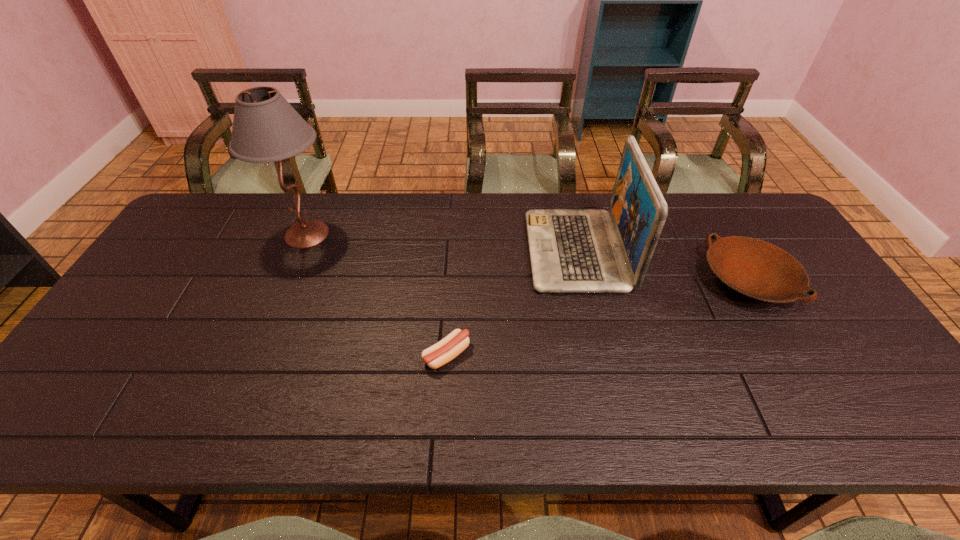
What are the coordinates of `vacant space at the right edge` in the screenshot? It's located at (819, 288).

This screenshot has height=540, width=960. Find the location of `vacant area at the far right corner of the desktop`. vacant area at the far right corner of the desktop is located at coordinates (750, 236).

The height and width of the screenshot is (540, 960). Find the location of `free area in between the third shortest object and the third tallest object`. free area in between the third shortest object and the third tallest object is located at coordinates (662, 265).

I want to click on empty space between the third shortest object and the leftmost object, so click(x=442, y=242).

This screenshot has height=540, width=960. What are the coordinates of `empty space between the third tallest object and the nearest object` in the screenshot? It's located at (597, 318).

Locate an element on the screen. The height and width of the screenshot is (540, 960). empty location between the plate and the laptop computer is located at coordinates (662, 265).

Locate an element on the screen. vacant space that's between the third shortest object and the rightmost object is located at coordinates [662, 265].

What are the coordinates of `free area in between the laptop computer and the leftmost object` in the screenshot? It's located at (442, 242).

Where is `free area in between the plate and the third shortest object`? free area in between the plate and the third shortest object is located at coordinates (662, 265).

Where is `free area in between the plate and the third object from right to left`? The width and height of the screenshot is (960, 540). free area in between the plate and the third object from right to left is located at coordinates (597, 318).